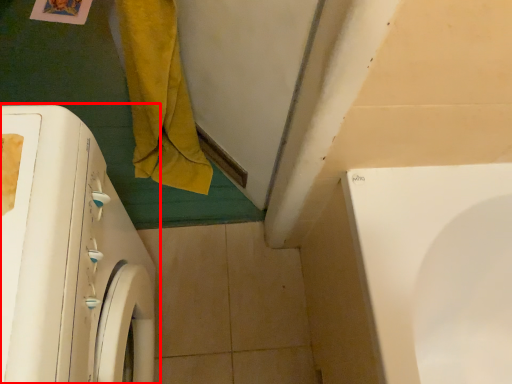
Question: From the image, what is the correct spatial relationship of washing machine (annotated by the red box) in relation to bath towel?

Choices:
 (A) left
 (B) right

Answer: (A)